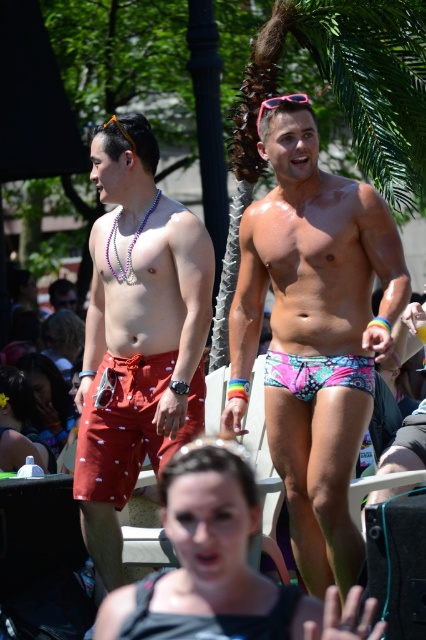
Question: Which of these objects is positioned closest to the green leafy palm tree at upper center?

Choices:
 (A) multicolored printed swim trunks at center
 (B) multicolored printed briefs at center
 (C) matte black hair at lower center
 (D) matte white bottle at lower left

Answer: (A)

Question: Is polka dot swim trunks at left positioned before matte white bottle at lower left?

Choices:
 (A) no
 (B) yes

Answer: (B)

Question: Where is polka dot swim trunks at left located in relation to matte black bikini top at lower center in the image?

Choices:
 (A) above
 (B) below

Answer: (A)

Question: Can you confirm if matte black bikini top at lower center is positioned above matte black hair at lower center?

Choices:
 (A) no
 (B) yes

Answer: (A)

Question: Among these objects, which one is farthest from the camera?

Choices:
 (A) multicolored printed briefs at center
 (B) green leafy palm tree at upper center

Answer: (B)

Question: Considering the real-world distances, which object is closest to the green leafy palm tree at upper center?

Choices:
 (A) matte white bottle at lower left
 (B) multicolored printed swim trunks at center

Answer: (B)